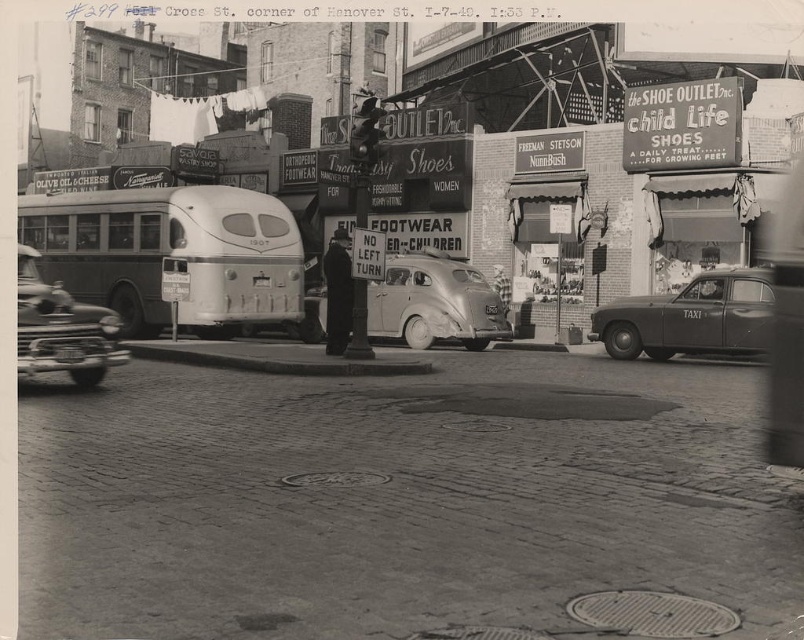
Question: Can you confirm if shiny silver sedan at center is bigger than shiny chrome sedan at lower left?

Choices:
 (A) no
 (B) yes

Answer: (B)

Question: Observing the image, what is the correct spatial positioning of shiny silver sedan at center in reference to shiny chrome sedan at lower left?

Choices:
 (A) right
 (B) left

Answer: (A)

Question: Which of the following is the farthest from the observer?

Choices:
 (A) (35, 308)
 (B) (745, 300)
 (C) (130, 305)
 (D) (419, 291)

Answer: (D)

Question: Which point is farther from the camera taking this photo?

Choices:
 (A) (68, 300)
 (B) (376, 330)
 (C) (621, 317)

Answer: (B)

Question: Does metallic silver bus at left appear on the right side of matte black taxi at right?

Choices:
 (A) yes
 (B) no

Answer: (B)

Question: Which object is positioned farthest from the shiny chrome sedan at lower left?

Choices:
 (A) shiny silver sedan at center
 (B) matte black taxi at right
 (C) metallic silver bus at left

Answer: (B)